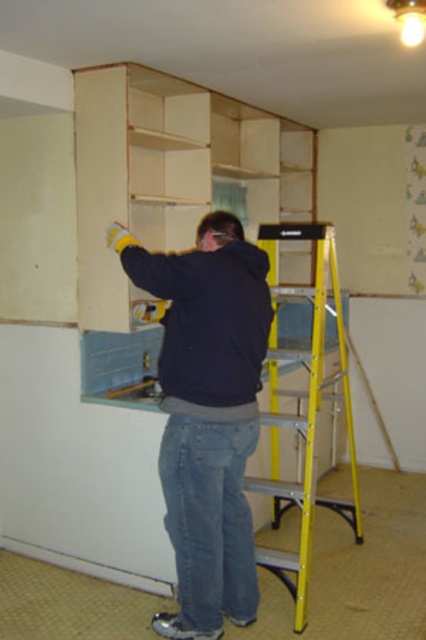
You are a painter who needs to reach the top of the cabinets. You see the dark blue jacket at center and the yellow metallic ladder at right. Which object is closer to the right side of the room?

The yellow metallic ladder at right is closer to the right side of the room because it is positioned to the right of the dark blue jacket at center.

Looking at this image, you are standing in the room and want to reach the point marked at coordinates (161, 385). The yellow ladder is available. Can you use the ladder to reach that point?

The point at coordinates (161, 385) is 8.28 feet away from the camera, so the yellow ladder can be used to reach it since it is positioned nearby.